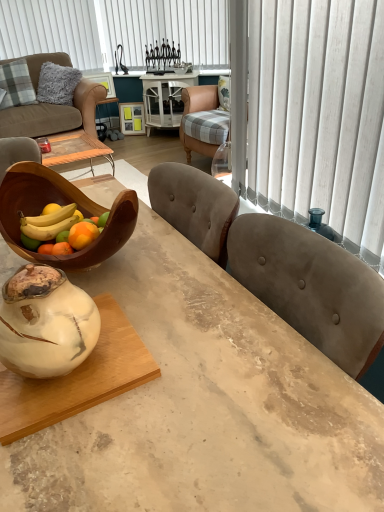
This screenshot has height=512, width=384. I want to click on space that is in front of white marble vase at center, so click(x=73, y=455).